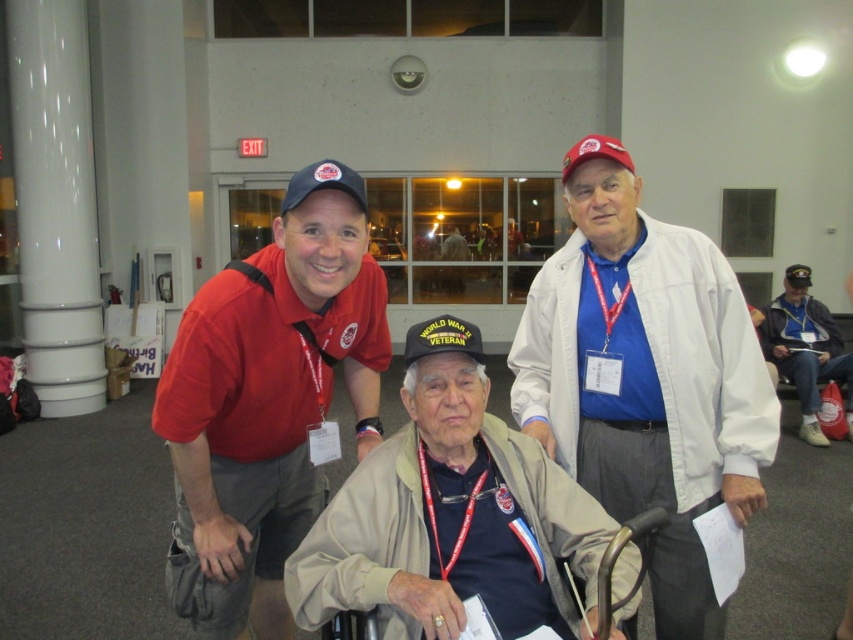
Does blue denim jacket at lower right have a larger size compared to beige fabric wheelchair at center?

Correct, blue denim jacket at lower right is larger in size than beige fabric wheelchair at center.

Between blue denim jacket at lower right and beige fabric wheelchair at center, which one has more height?

blue denim jacket at lower right is taller.

Is point (790, 268) more distant than point (610, 548)?

Yes, point (790, 268) is behind point (610, 548).

You are a GUI agent. You are given a task and a screenshot of the screen. Output one action in this format:
    pyautogui.click(x=<x>, y=<y>)
    Task: Click on the blue denim jacket at lower right
    The height and width of the screenshot is (640, 853).
    Given the screenshot: What is the action you would take?
    pyautogui.click(x=805, y=352)

Which is above, white cotton jacket at upper right or beige fabric wheelchair at center?

white cotton jacket at upper right is above.

Does white cotton jacket at upper right have a greater width compared to beige fabric wheelchair at center?

Indeed, white cotton jacket at upper right has a greater width compared to beige fabric wheelchair at center.

Locate an element on the screen. Image resolution: width=853 pixels, height=640 pixels. white cotton jacket at upper right is located at coordinates (645, 378).

You are a GUI agent. You are given a task and a screenshot of the screen. Output one action in this format:
    pyautogui.click(x=<x>, y=<y>)
    Task: Click on the white cotton jacket at upper right
    Image resolution: width=853 pixels, height=640 pixels.
    Given the screenshot: What is the action you would take?
    pyautogui.click(x=645, y=378)

Does white cotton jacket at upper right lie in front of blue denim jacket at lower right?

Yes, white cotton jacket at upper right is closer to the viewer.

Which is behind, point (701, 444) or point (791, 291)?

Positioned behind is point (791, 291).

Locate an element on the screen. The image size is (853, 640). white cotton jacket at upper right is located at coordinates (645, 378).